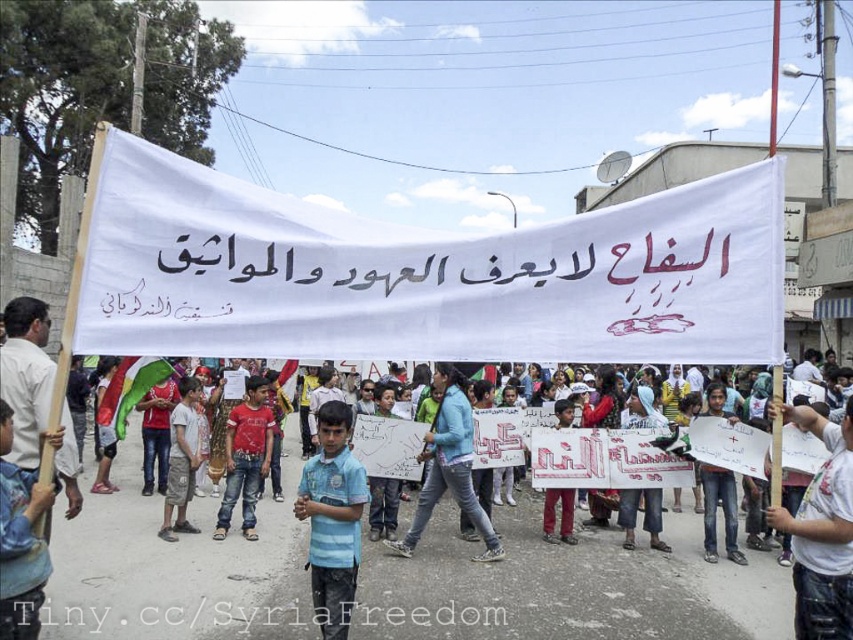
Is blue striped shirt at center bigger than blue fabric at center?

Correct, blue striped shirt at center is larger in size than blue fabric at center.

Is point (339, 480) behind point (3, 499)?

That is True.

This screenshot has height=640, width=853. I want to click on blue striped shirt at center, so click(332, 518).

Can you confirm if white paper banner at center is shorter than blue jeans at center?

Yes.

Does white paper banner at center have a larger size compared to blue jeans at center?

Actually, white paper banner at center might be smaller than blue jeans at center.

I want to click on white paper banner at center, so (425, 275).

Where is `white paper banner at center`? white paper banner at center is located at coordinates (425, 275).

Which of these two, blue striped shirt at center or green fabric flag at center, stands taller?

blue striped shirt at center is taller.

Describe the element at coordinates (332, 518) in the screenshot. I see `blue striped shirt at center` at that location.

This screenshot has width=853, height=640. Identify the location of blue striped shirt at center. (332, 518).